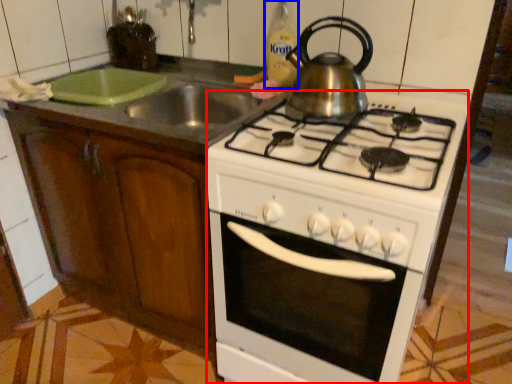
Question: Among these objects, which one is farthest to the camera, oven (highlighted by a red box) or bottle (highlighted by a blue box)?

Choices:
 (A) oven
 (B) bottle

Answer: (B)